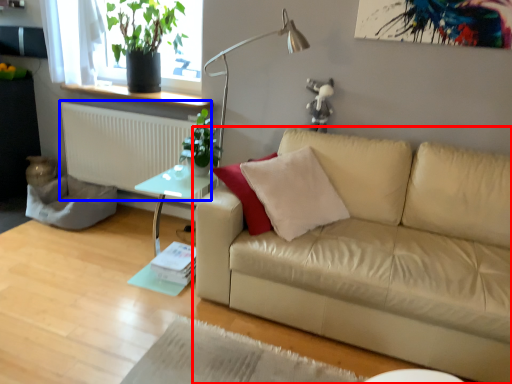
Question: Among these objects, which one is farthest to the camera, studio couch (highlighted by a red box) or radiator (highlighted by a blue box)?

Choices:
 (A) studio couch
 (B) radiator

Answer: (B)